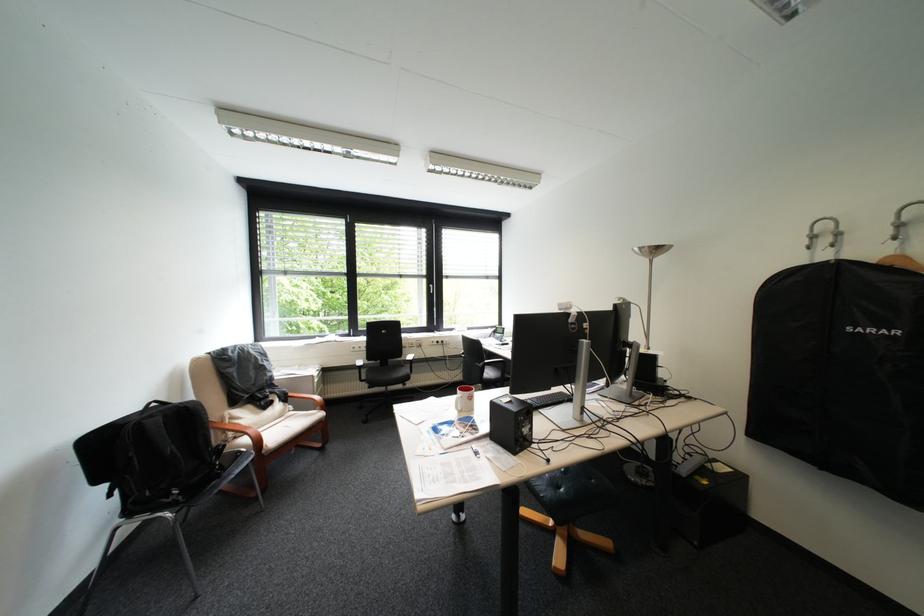
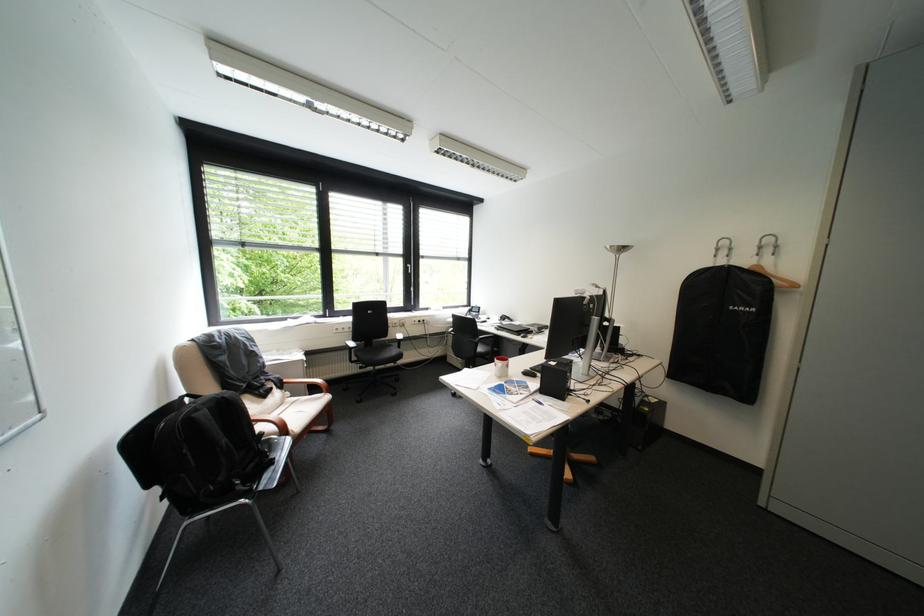
The point at (521, 400) is marked in the first image. Where is the corresponding point in the second image?

(568, 363)